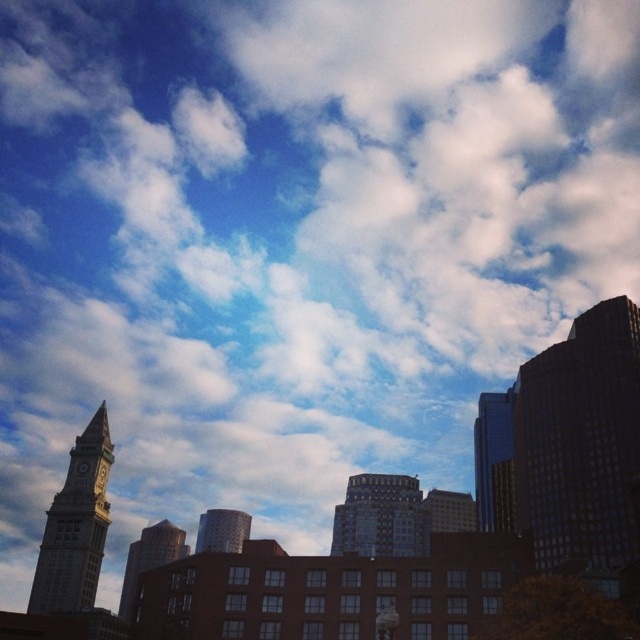
Question: Is dark glass skyscraper at right thinner than gold metallic clock at lower left?

Choices:
 (A) yes
 (B) no

Answer: (B)

Question: Can you confirm if stone clock tower at left is bigger than brown brick building at center?

Choices:
 (A) no
 (B) yes

Answer: (A)

Question: Among these objects, which one is farthest from the camera?

Choices:
 (A) dark glass skyscraper at right
 (B) stone clock tower at left
 (C) gold metallic clock at lower left
 (D) brown brick building at center

Answer: (C)

Question: Can you confirm if stone clock tower at left is thinner than shiny glass skyscraper at right?

Choices:
 (A) no
 (B) yes

Answer: (B)

Question: Based on their relative distances, which object is farther from the brown brick building at center?

Choices:
 (A) metallic clock face at left
 (B) smooth glass building at center
 (C) shiny glass skyscraper at right

Answer: (C)

Question: Which point is farther to the camera?

Choices:
 (A) stone clock tower at left
 (B) gold metallic clock at lower left
 (C) brown brick building at center
 (D) dark glass skyscraper at right

Answer: (B)